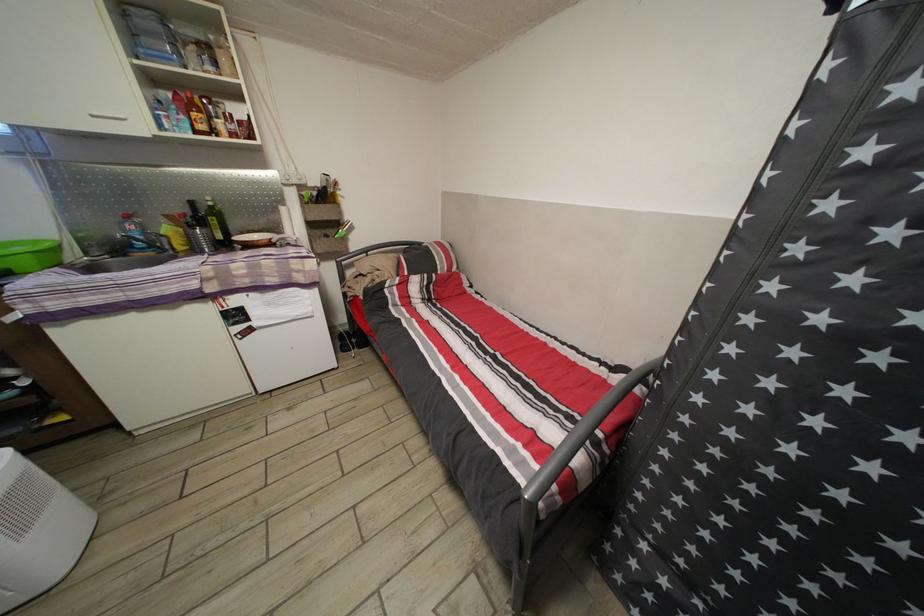
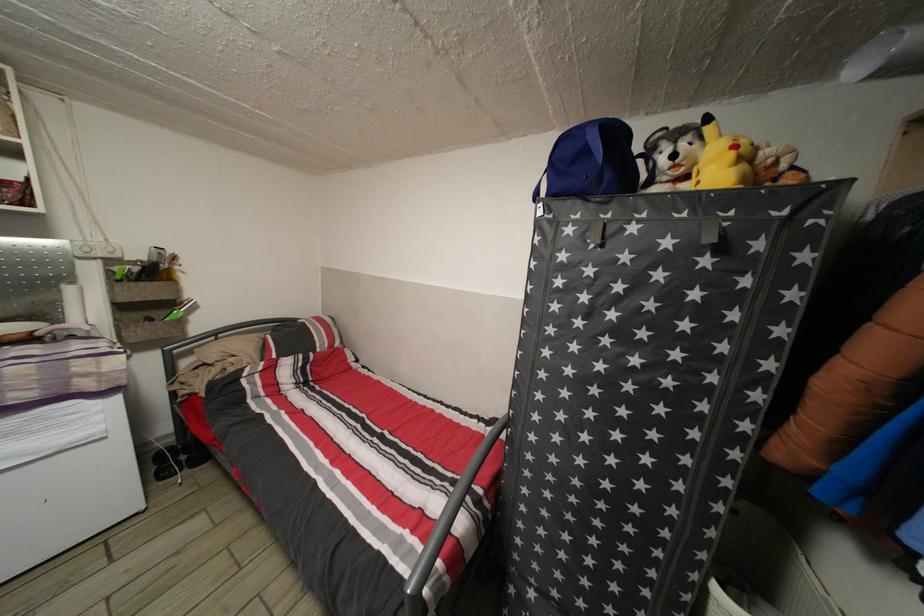
Locate, in the second image, the point that corresponds to point (362, 357) in the first image.

(192, 477)